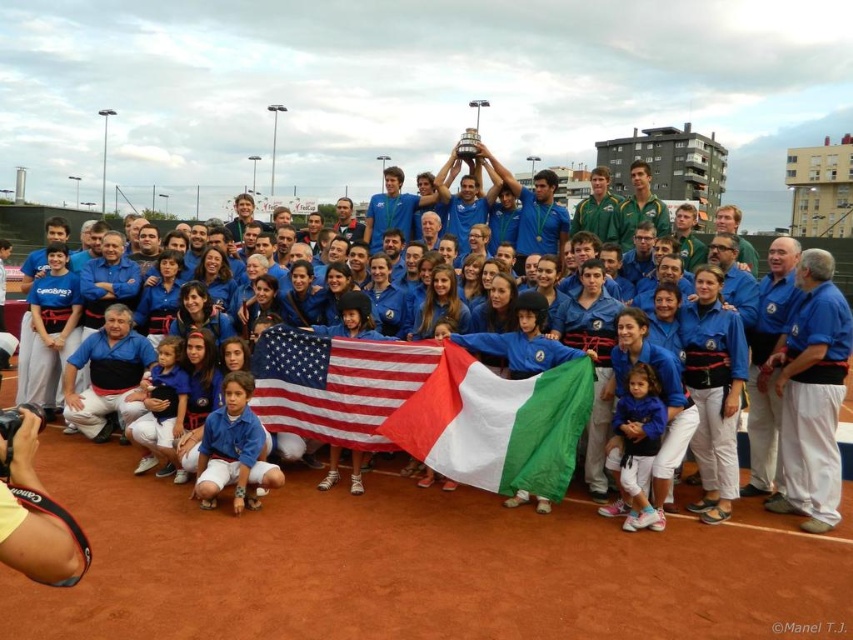
Question: Does green matte flag at center appear over american flag at center?

Choices:
 (A) no
 (B) yes

Answer: (A)

Question: Which point is closer to the camera?

Choices:
 (A) green matte flag at center
 (B) blue fabric shirt at lower left
 (C) blue fabric flag at center

Answer: (B)

Question: Among these points, which one is nearest to the camera?

Choices:
 (A) (451, 380)
 (B) (610, 291)
 (C) (257, 484)
 (D) (273, 397)

Answer: (C)

Question: Is green matte flag at center below american flag at center?

Choices:
 (A) no
 (B) yes

Answer: (B)

Question: Does blue fabric flag at center appear over blue fabric shirt at lower left?

Choices:
 (A) yes
 (B) no

Answer: (A)

Question: Among these objects, which one is farthest from the camera?

Choices:
 (A) blue fabric flag at center
 (B) blue fabric shirt at lower left

Answer: (A)